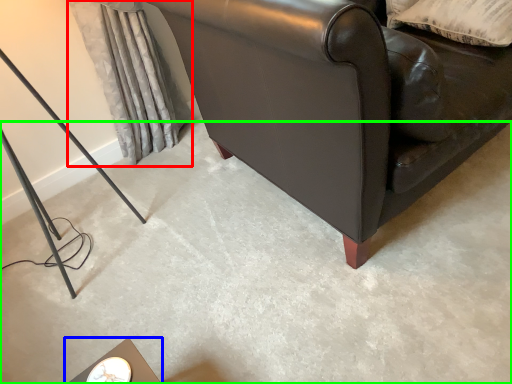
Question: Which is nearer to the curtain (highlighted by a red box)? table (highlighted by a blue box) or concrete (highlighted by a green box).

Choices:
 (A) table
 (B) concrete

Answer: (B)